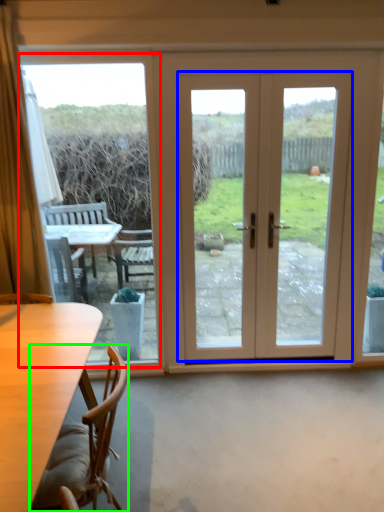
Question: Estimate the real-world distances between objects in this image. Which object is closer to window screen (highlighted by a red box), door (highlighted by a blue box) or chair (highlighted by a green box)?

Choices:
 (A) door
 (B) chair

Answer: (B)